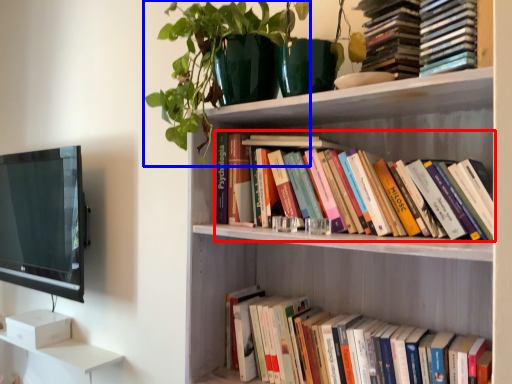
Question: Which object appears closest to the camera in this image, book (highlighted by a red box) or plant (highlighted by a blue box)?

Choices:
 (A) book
 (B) plant

Answer: (A)